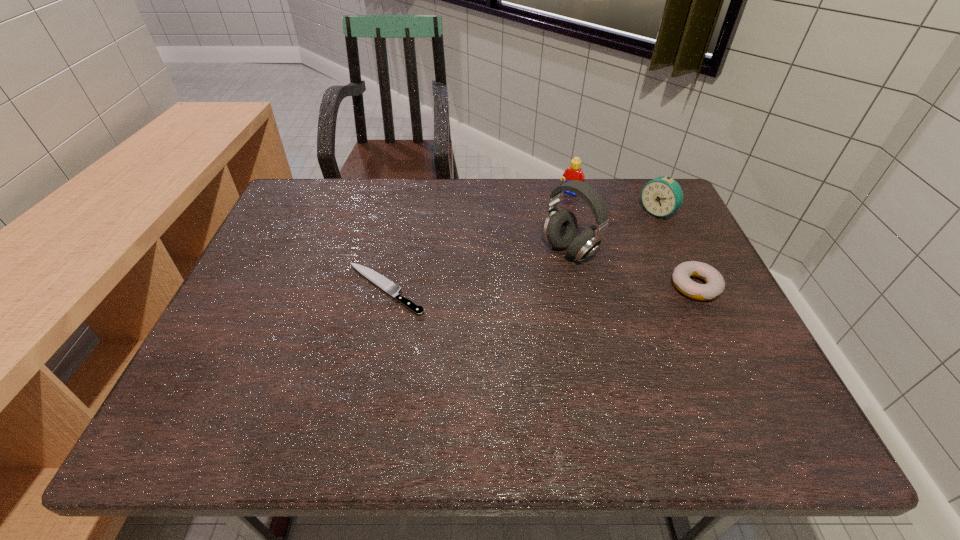
I want to click on vacant space situated 0.360m on the front-facing side of the alarm clock, so pos(564,279).

Locate an element on the screen. The width and height of the screenshot is (960, 540). vacant area situated on the front-facing side of the farthest object is located at coordinates (540, 229).

Locate an element on the screen. The width and height of the screenshot is (960, 540). vacant space located on the front-facing side of the farthest object is located at coordinates (505, 273).

Where is `vacant area situated 0.060m on the front-facing side of the farthest object`? The width and height of the screenshot is (960, 540). vacant area situated 0.060m on the front-facing side of the farthest object is located at coordinates (558, 207).

This screenshot has height=540, width=960. Identify the location of free space located on the ear cups of the headset. (456, 316).

Where is `vacant space located 0.050m on the ear cups of the headset`? This screenshot has height=540, width=960. vacant space located 0.050m on the ear cups of the headset is located at coordinates (536, 271).

You are a GUI agent. You are given a task and a screenshot of the screen. Output one action in this format:
    pyautogui.click(x=<x>, y=<y>)
    Task: Click on the free space located 0.200m on the ear cups of the headset
    The width and height of the screenshot is (960, 540).
    Given the screenshot: What is the action you would take?
    pyautogui.click(x=491, y=297)

Locate an element on the screen. The image size is (960, 540). alarm clock that is positioned at the far edge is located at coordinates 662,196.

This screenshot has height=540, width=960. In order to click on Lego that is at the far edge in this screenshot , I will do `click(574, 172)`.

The height and width of the screenshot is (540, 960). Identify the location of doughnut at the right edge. (715, 284).